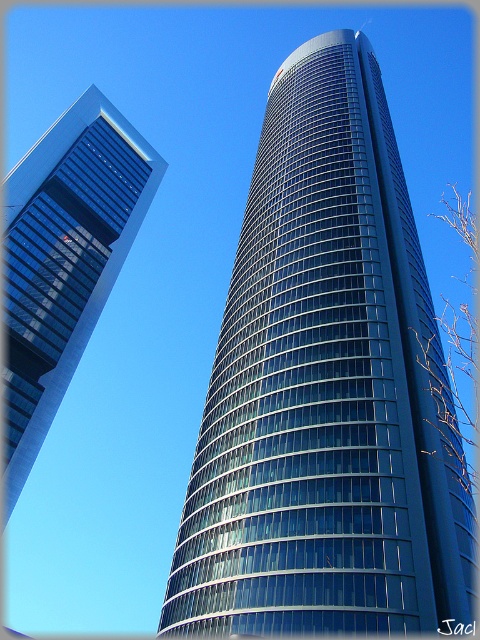
You are standing at the point with coordinates point (325, 388). Looking around, you see the glassy blue skyscraper at center. Which direction should you face to look directly at the glassy blue skyscraper at center?

You are already facing the glassy blue skyscraper at center because the point (325, 388) corresponds to its location.

You are a drone operator who needs to fly a drone between the two glassy blue skyscrapers. The drone has a maximum flight distance of 150 feet. Based on the scene, can the drone safely navigate the space between the glassy blue skyscraper at center and the glassy blue skyscraper at left?

The glassy blue skyscraper at center and glassy blue skyscraper at left are 144.79 feet apart from each other. Since the drone has a maximum flight distance of 150 feet, it can safely navigate the space between them as the distance is within the drone operator limits.

You are standing at the origin point of the coordinate system in the image. You want to reach the glassy blue skyscraper at center. In which direction should you move to get closer to it?

Since the glassy blue skyscraper at center is located at coordinates point (325, 388), you should move in the positive x and positive y direction to reach it.